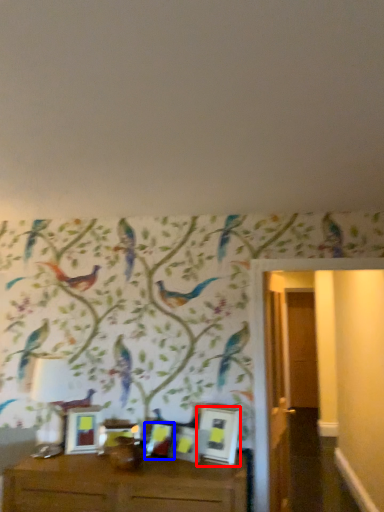
Question: Which point is further to the camera, picture frame (highlighted by a red box) or picture frame (highlighted by a blue box)?

Choices:
 (A) picture frame
 (B) picture frame

Answer: (B)